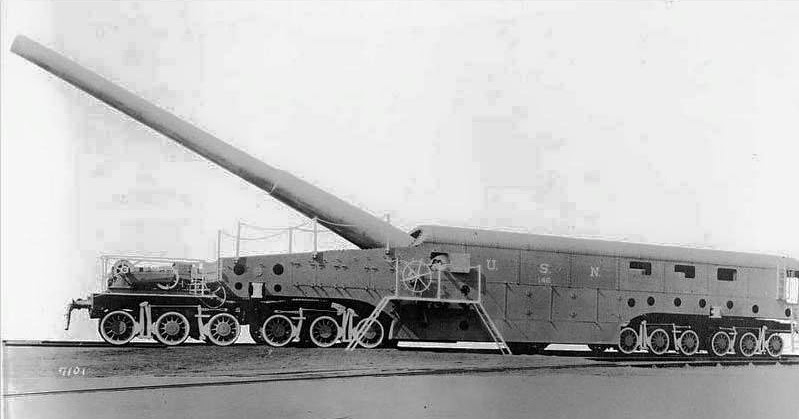
This screenshot has height=419, width=799. I want to click on rectangle window, so click(650, 264), click(685, 268), click(726, 272).